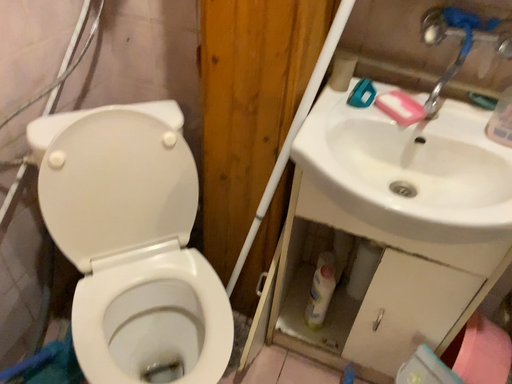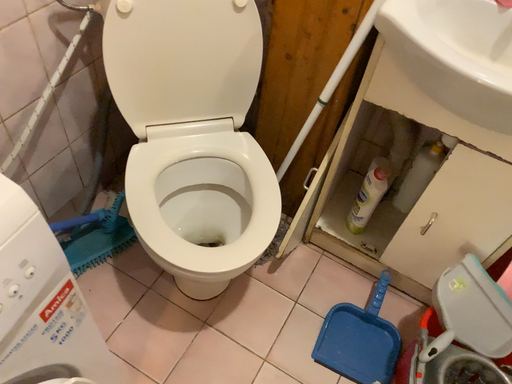
Question: How did the camera likely rotate when shooting the video?

Choices:
 (A) rotated upward
 (B) rotated downward

Answer: (B)